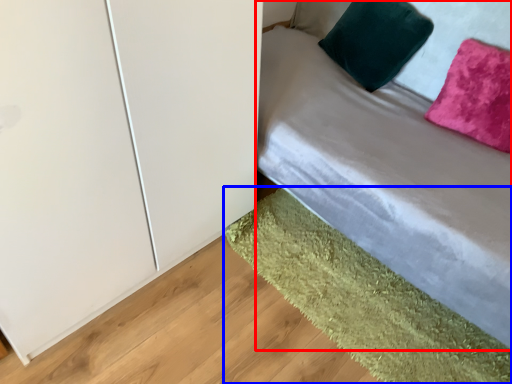
Question: Among these objects, which one is farthest to the camera, bed (highlighted by a red box) or mat (highlighted by a blue box)?

Choices:
 (A) bed
 (B) mat

Answer: (B)